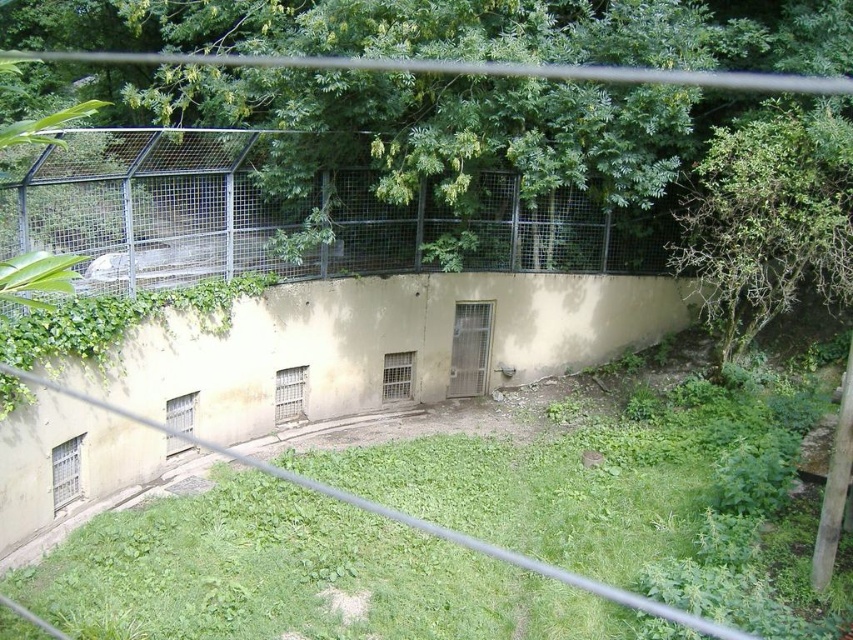
Question: Is metal mesh fence at upper center below green leafy tree at upper right?

Choices:
 (A) yes
 (B) no

Answer: (B)

Question: Does metal mesh fence at upper center have a greater width compared to green grass at lower center?

Choices:
 (A) yes
 (B) no

Answer: (B)

Question: Does metal mesh fence at upper center have a lesser width compared to green leafy tree at upper right?

Choices:
 (A) no
 (B) yes

Answer: (A)

Question: Which of the following is the closest to the observer?

Choices:
 (A) green grass at lower center
 (B) green leafy tree at upper right

Answer: (A)

Question: Which of the following is the closest to the observer?

Choices:
 (A) green leafy tree at upper right
 (B) metal mesh fence at upper center

Answer: (B)

Question: Which object appears farthest from the camera in this image?

Choices:
 (A) metal mesh fence at upper center
 (B) green grass at lower center

Answer: (A)